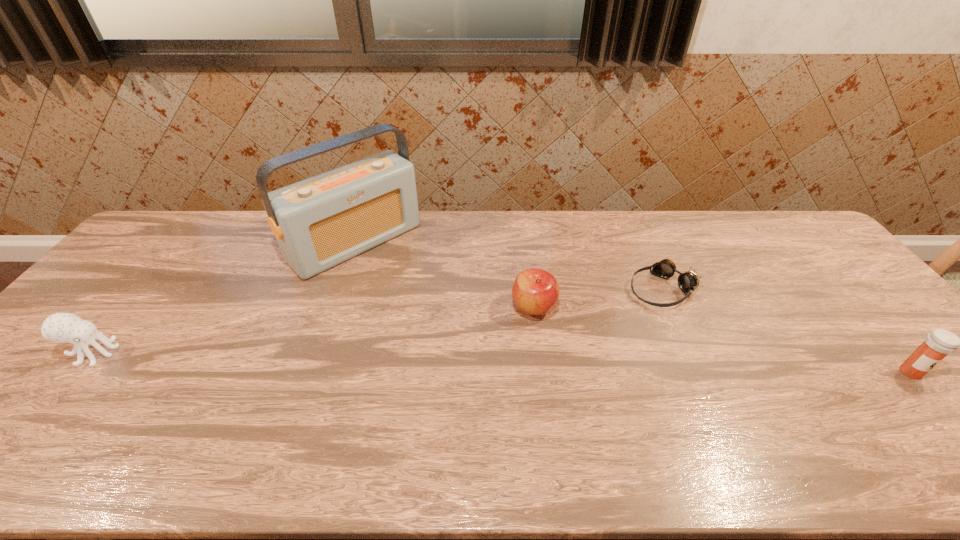
Image resolution: width=960 pixels, height=540 pixels. In order to click on the leftmost object in this screenshot , I will do `click(60, 327)`.

Where is `medicine`? medicine is located at coordinates (939, 343).

Locate an element on the screen. apple is located at coordinates (535, 291).

Identify the location of the shortest object. The width and height of the screenshot is (960, 540). (689, 280).

Find the location of a particular element. The width and height of the screenshot is (960, 540). the fourth object from left to right is located at coordinates (689, 280).

The image size is (960, 540). Find the location of `the fourth object from right to left`. the fourth object from right to left is located at coordinates (319, 222).

Locate an element on the screen. The height and width of the screenshot is (540, 960). the tallest object is located at coordinates (319, 222).

Locate an element on the screen. The width and height of the screenshot is (960, 540). free region located 0.100m on the front-facing side of the leftmost object is located at coordinates (156, 353).

Locate an element on the screen. The height and width of the screenshot is (540, 960). free space located 0.220m on the stem of the third object from right to left is located at coordinates (582, 390).

Where is `vacant space located 0.230m on the stem of the third object from right to left`? The height and width of the screenshot is (540, 960). vacant space located 0.230m on the stem of the third object from right to left is located at coordinates (584, 393).